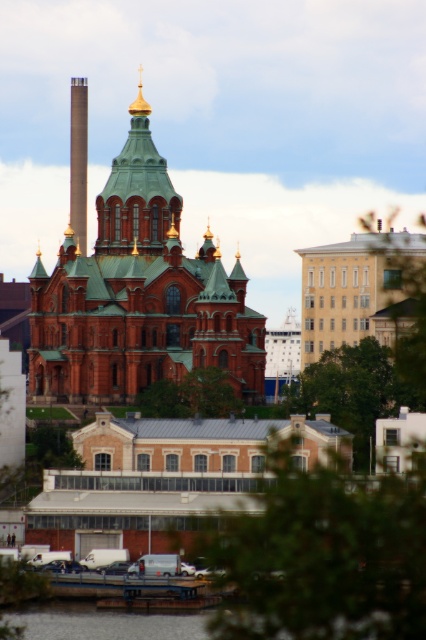
Question: Which point is closer to the camera?

Choices:
 (A) green leafy tree at right
 (B) green leafy tree at lower center
 (C) green leafy tree at lower right
 (D) green leafy tree at center

Answer: (B)

Question: Is green leafy tree at right below green leafy tree at center?

Choices:
 (A) yes
 (B) no

Answer: (B)

Question: Considering the real-world distances, which object is farthest from the green leafy tree at lower right?

Choices:
 (A) white smooth building at center
 (B) green leafy tree at lower center
 (C) green leafy tree at right
 (D) green leafy tree at center

Answer: (B)

Question: In this image, where is green copper dome at center located relative to green leafy tree at right?

Choices:
 (A) above
 (B) below

Answer: (A)

Question: Is white smooth building at center further to camera compared to green leafy tree at right?

Choices:
 (A) no
 (B) yes

Answer: (B)

Question: Which point is closer to the camera taking this photo?

Choices:
 (A) (184, 406)
 (B) (423, 582)

Answer: (B)